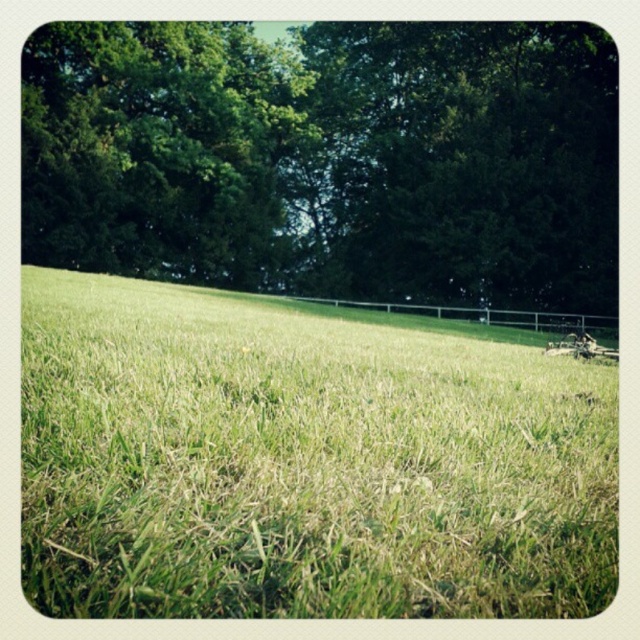
Does green grass at center have a larger size compared to green leafy tree at upper left?

No, green grass at center is not bigger than green leafy tree at upper left.

What do you see at coordinates (301, 461) in the screenshot?
I see `green grass at center` at bounding box center [301, 461].

Locate an element on the screen. This screenshot has width=640, height=640. green grass at center is located at coordinates (301, 461).

Which of these two, green grass at center or green leafy tree at upper center, stands taller?

green leafy tree at upper center is taller.

Does green grass at center come behind green leafy tree at upper center?

No, green grass at center is closer to the viewer.

Between point (58, 400) and point (385, 182), which one is positioned behind?

Positioned behind is point (385, 182).

Where is `green grass at center`? The image size is (640, 640). green grass at center is located at coordinates (301, 461).

This screenshot has height=640, width=640. Describe the element at coordinates (328, 157) in the screenshot. I see `green leafy tree at upper center` at that location.

Can you confirm if green leafy tree at upper center is smaller than green leafy tree at upper left?

Actually, green leafy tree at upper center might be larger than green leafy tree at upper left.

Does point (424, 193) lie behind point (51, 44)?

Yes, point (424, 193) is farther from viewer.

Identify the location of green leafy tree at upper center. The image size is (640, 640). (328, 157).